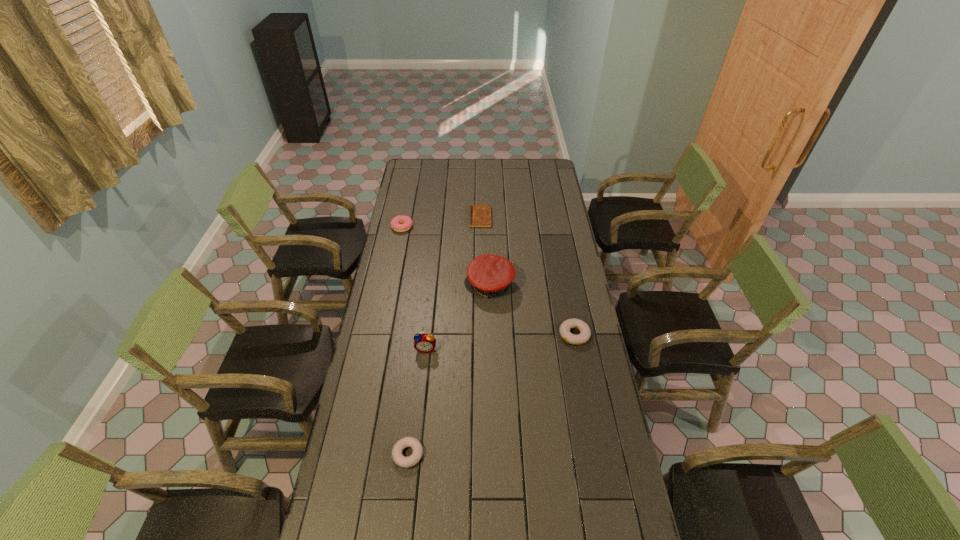
Identify the location of vacant space located 0.280m on the left of the rightmost doughnut. The image size is (960, 540). (491, 335).

This screenshot has width=960, height=540. What are the coordinates of `vacant space located 0.370m on the back of the leftmost object` in the screenshot? It's located at (411, 181).

Find the location of a particular element. free space located on the front-facing side of the alarm clock is located at coordinates (418, 431).

This screenshot has height=540, width=960. I want to click on vacant space located 0.180m on the spine side of the shortest object, so click(435, 218).

This screenshot has height=540, width=960. I want to click on free space located 0.260m on the spine side of the shortest object, so click(420, 218).

The width and height of the screenshot is (960, 540). Find the location of `vacant space located 0.080m on the spine side of the shortest object`. vacant space located 0.080m on the spine side of the shortest object is located at coordinates click(x=454, y=218).

At what (x,y) coordinates should I click in order to perform the action: click on blank space located on the front of the cap with an emblem. Please return your answer as a coordinate pair (x, y). The height and width of the screenshot is (540, 960). Looking at the image, I should click on (440, 286).

Locate an element on the screen. free region located 0.200m on the front of the cap with an emblem is located at coordinates point(420,286).

Image resolution: width=960 pixels, height=540 pixels. What are the coordinates of `free space located on the front of the cap with an emblem` in the screenshot? It's located at (411, 286).

The height and width of the screenshot is (540, 960). Identify the location of object that is at the left edge. (396, 225).